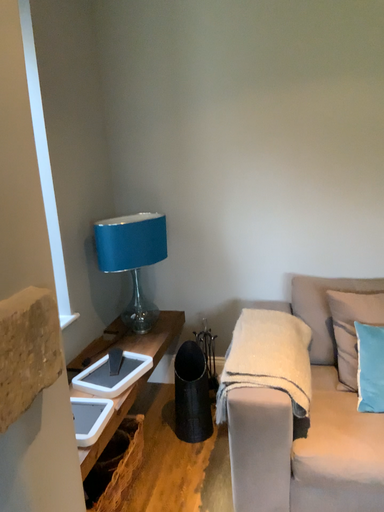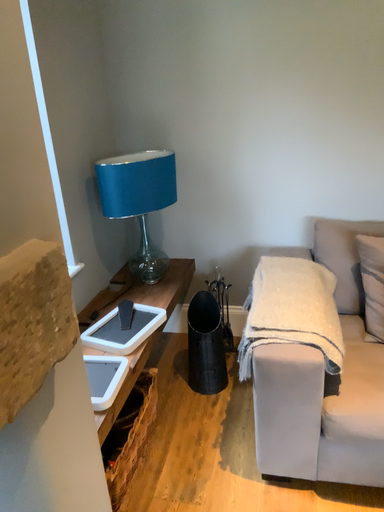
Question: Which way did the camera rotate in the video?

Choices:
 (A) rotated upward
 (B) rotated downward

Answer: (B)